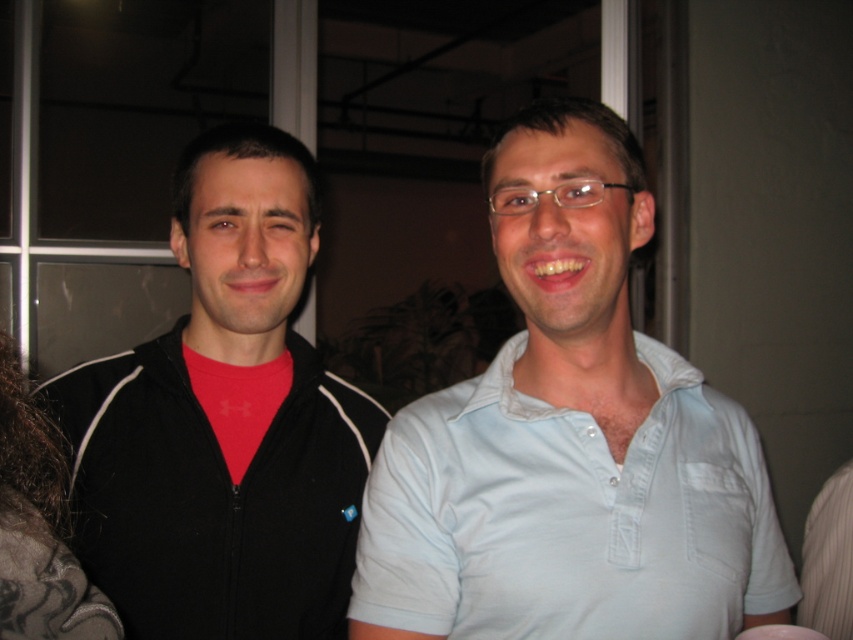
Question: Can you confirm if black matte jacket at left is smaller than light blue cotton polo shirt at center?

Choices:
 (A) yes
 (B) no

Answer: (B)

Question: Which point is farther from the camera taking this photo?

Choices:
 (A) (42, 532)
 (B) (289, 508)
 (C) (700, 502)

Answer: (B)

Question: Among these points, which one is nearest to the camera?

Choices:
 (A) (32, 529)
 (B) (494, 408)

Answer: (A)

Question: Is black matte jacket at left positioned at the back of light blue cotton polo shirt at center?

Choices:
 (A) no
 (B) yes

Answer: (B)

Question: Is black matte jacket at left to the right of light blue cotton polo shirt at center from the viewer's perspective?

Choices:
 (A) yes
 (B) no

Answer: (B)

Question: Among these points, which one is farthest from the camera?

Choices:
 (A) (663, 632)
 (B) (56, 442)

Answer: (B)